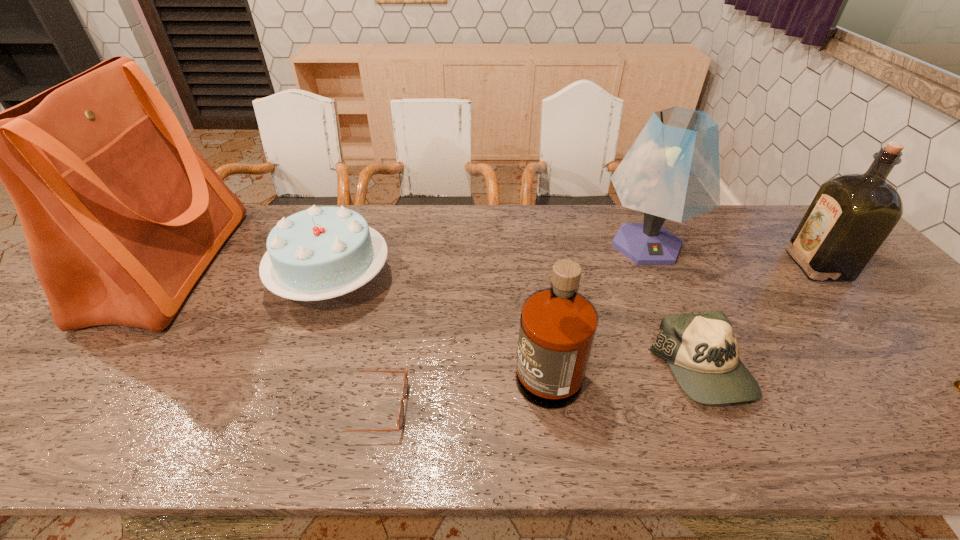
Where is `free space between the sunglasses and the left liquor`? The height and width of the screenshot is (540, 960). free space between the sunglasses and the left liquor is located at coordinates (459, 384).

Locate which object is the second closest to the lampshade. Please provide its 2D coordinates. Your answer should be formatted as a tuple, i.e. [(x, y)], where the tuple contains the x and y coordinates of a point satisfying the conditions above.

[(558, 325)]

At what (x,y) coordinates should I click in order to perform the action: click on the fifth closest object to the farther liquor. Please return your answer as a coordinate pair (x, y). This screenshot has width=960, height=540. Looking at the image, I should click on point(400,419).

Locate an element on the screen. The image size is (960, 540). free space that satisfies the following two spatial constraints: 1. on the label of the farther liquor; 2. on the front-facing side of the baseball cap is located at coordinates (910, 370).